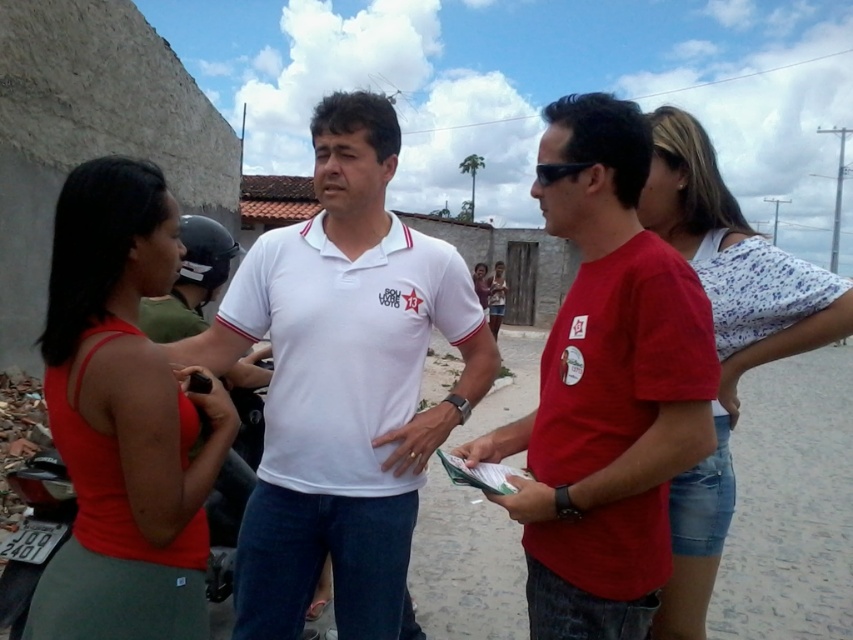
Question: Which of the following is the closest to the observer?

Choices:
 (A) (486, 280)
 (B) (784, 330)

Answer: (B)

Question: Is matte red tank top at left closer to the viewer compared to matte white shirt at center?

Choices:
 (A) yes
 (B) no

Answer: (A)

Question: Is matte red t-shirt at center wider than matte red tank top at left?

Choices:
 (A) yes
 (B) no

Answer: (A)

Question: Which object is the closest to the matte red tank top at center?

Choices:
 (A) matte white shirt at center
 (B) white cotton polo shirt at center

Answer: (A)

Question: Can you confirm if matte red t-shirt at center is positioned to the left of white cotton polo shirt at center?

Choices:
 (A) yes
 (B) no

Answer: (B)

Question: Which object is positioned closest to the matte red tank top at center?

Choices:
 (A) matte red tank top at left
 (B) white cotton polo shirt at center

Answer: (B)